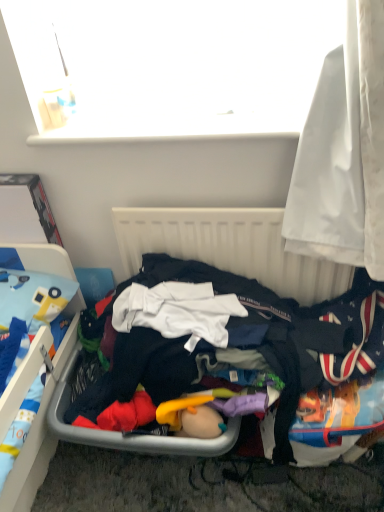
Question: Does white fabric curtain at right have a greater width compared to dark blue fabric at center?

Choices:
 (A) yes
 (B) no

Answer: (B)

Question: Would you say white fabric curtain at right is a long distance from dark blue fabric at center?

Choices:
 (A) no
 (B) yes

Answer: (A)

Question: Is white fabric curtain at right positioned beyond the bounds of dark blue fabric at center?

Choices:
 (A) no
 (B) yes

Answer: (B)

Question: Does white fabric curtain at right come in front of dark blue fabric at center?

Choices:
 (A) yes
 (B) no

Answer: (A)

Question: Does white fabric curtain at right have a lesser width compared to dark blue fabric at center?

Choices:
 (A) no
 (B) yes

Answer: (B)

Question: Considering the positions of white plastic radiator at center and dark blue fabric at center in the image, is white plastic radiator at center taller or shorter than dark blue fabric at center?

Choices:
 (A) short
 (B) tall

Answer: (B)

Question: Is white plastic radiator at center spatially inside dark blue fabric at center, or outside of it?

Choices:
 (A) outside
 (B) inside

Answer: (A)

Question: Is white plastic radiator at center bigger or smaller than dark blue fabric at center?

Choices:
 (A) small
 (B) big

Answer: (A)

Question: Is white plastic radiator at center wider or thinner than dark blue fabric at center?

Choices:
 (A) wide
 (B) thin

Answer: (B)

Question: Considering the positions of point (301, 158) and point (182, 358), is point (301, 158) closer or farther from the camera than point (182, 358)?

Choices:
 (A) farther
 (B) closer

Answer: (B)

Question: In terms of width, does white fabric curtain at right look wider or thinner when compared to dark blue fabric at center?

Choices:
 (A) thin
 (B) wide

Answer: (A)

Question: In the image, is white fabric curtain at right positioned in front of or behind dark blue fabric at center?

Choices:
 (A) behind
 (B) front

Answer: (B)

Question: From a real-world perspective, is white fabric curtain at right physically located above or below dark blue fabric at center?

Choices:
 (A) below
 (B) above

Answer: (B)

Question: Is white plastic radiator at center bigger or smaller than white fabric curtain at right?

Choices:
 (A) big
 (B) small

Answer: (B)

Question: From the image's perspective, relative to white fabric curtain at right, is white plastic radiator at center above or below?

Choices:
 (A) below
 (B) above

Answer: (A)